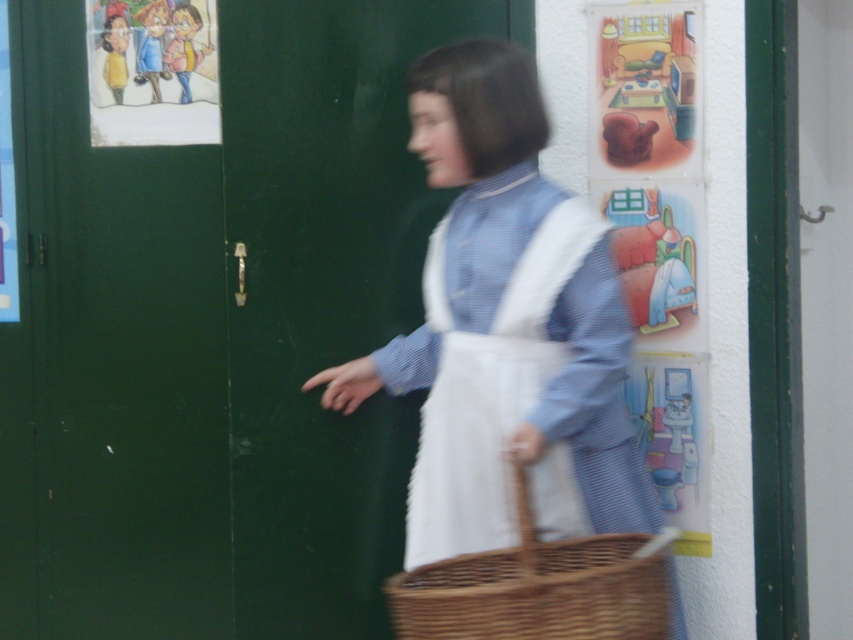
Is green matte door at left shorter than woven brown basket at center?

No, green matte door at left is not shorter than woven brown basket at center.

Measure the distance between point (149, 621) and camera.

They are 3.60 meters apart.

This screenshot has width=853, height=640. What are the coordinates of `green matte door at left` in the screenshot? It's located at (109, 368).

Between cartoon paper at upper left and matte plastic poster at upper left, which one appears on the right side from the viewer's perspective?

Positioned to the right is cartoon paper at upper left.

Who is lower down, cartoon paper at upper left or matte plastic poster at upper left?

matte plastic poster at upper left is below.

The width and height of the screenshot is (853, 640). What are the coordinates of `cartoon paper at upper left` in the screenshot? It's located at (152, 72).

Identify the location of cartoon paper at upper left. (152, 72).

Is white cotton apron at center to the left of woven brown basket at center from the viewer's perspective?

Yes, white cotton apron at center is to the left of woven brown basket at center.

Which of these two, white cotton apron at center or woven brown basket at center, stands taller?

With more height is white cotton apron at center.

Image resolution: width=853 pixels, height=640 pixels. What do you see at coordinates (506, 326) in the screenshot?
I see `white cotton apron at center` at bounding box center [506, 326].

At what (x,y) coordinates should I click in order to perform the action: click on white cotton apron at center. Please return your answer as a coordinate pair (x, y). Looking at the image, I should click on (506, 326).